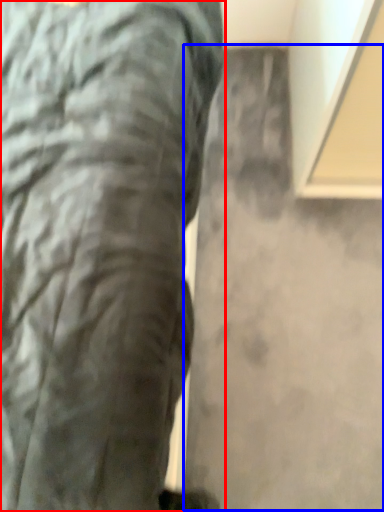
Question: Which point is closer to the camera, trousers (highlighted by a red box) or concrete (highlighted by a blue box)?

Choices:
 (A) trousers
 (B) concrete

Answer: (A)